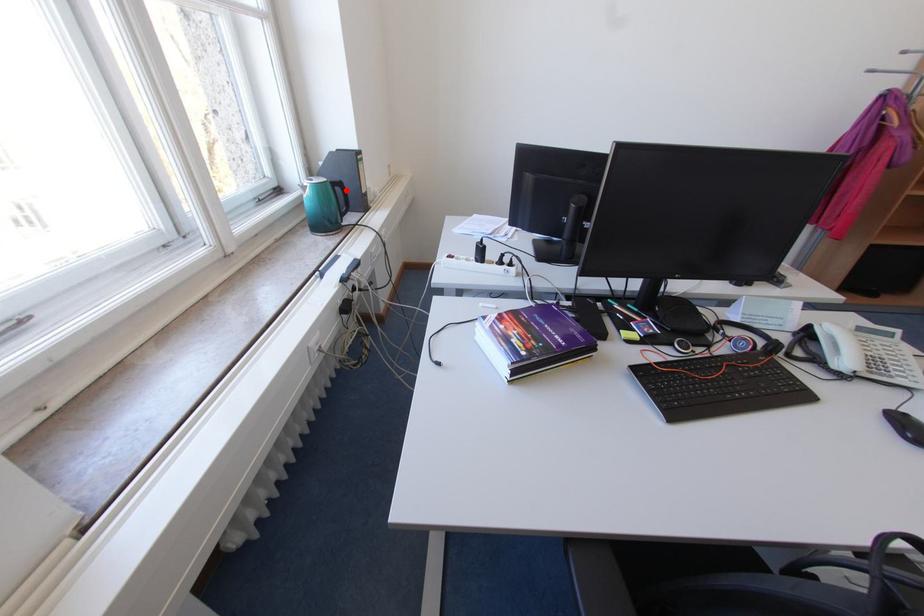
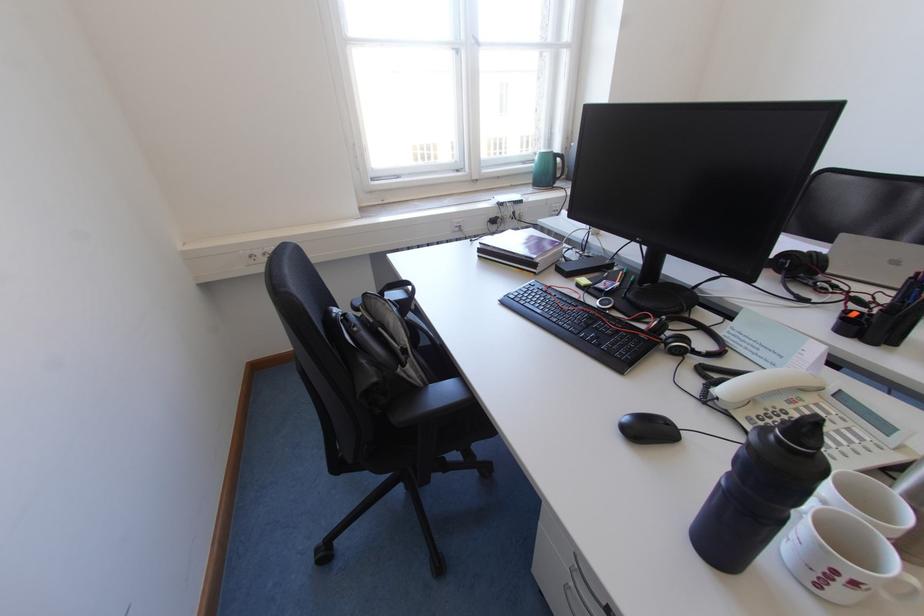
In the second image, find the point that corresponds to the highlighted location in the first image.

(566, 161)